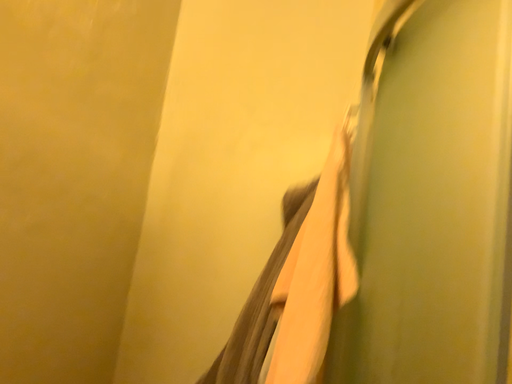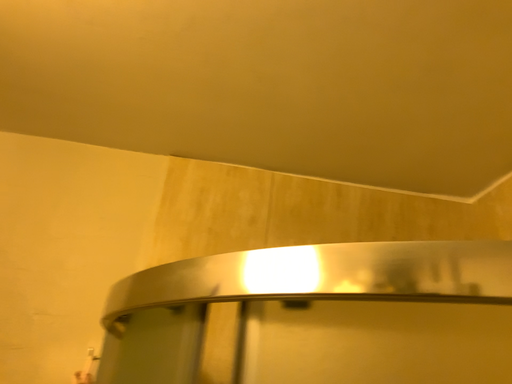
Question: Which way did the camera rotate in the video?

Choices:
 (A) rotated upward
 (B) rotated downward

Answer: (A)